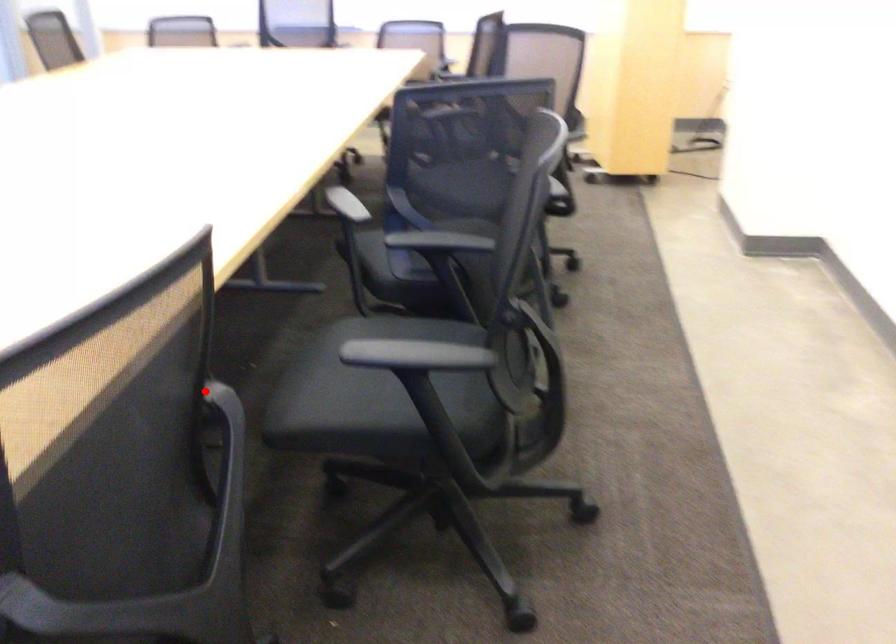
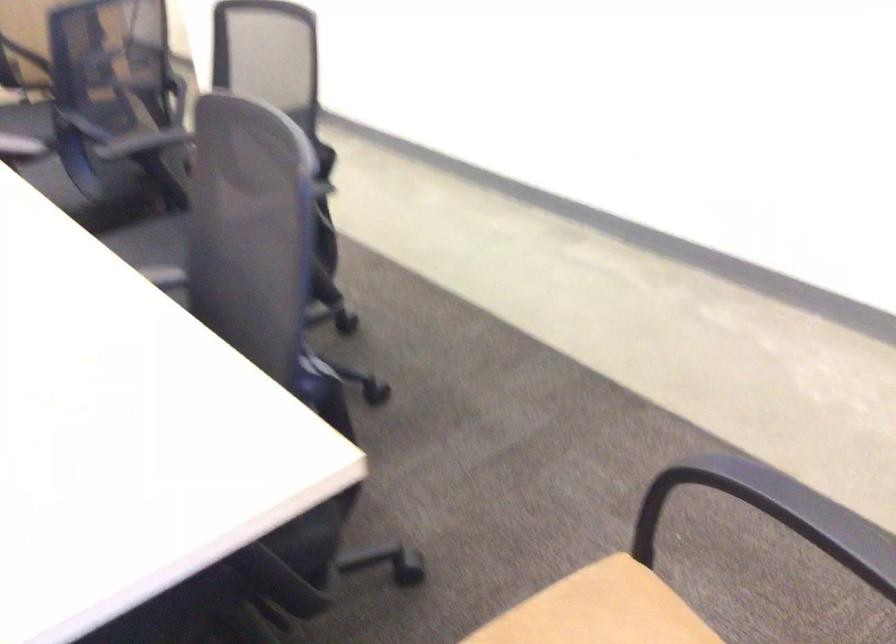
Locate, in the second image, the point that corresponds to the highlighted location in the first image.

(165, 275)